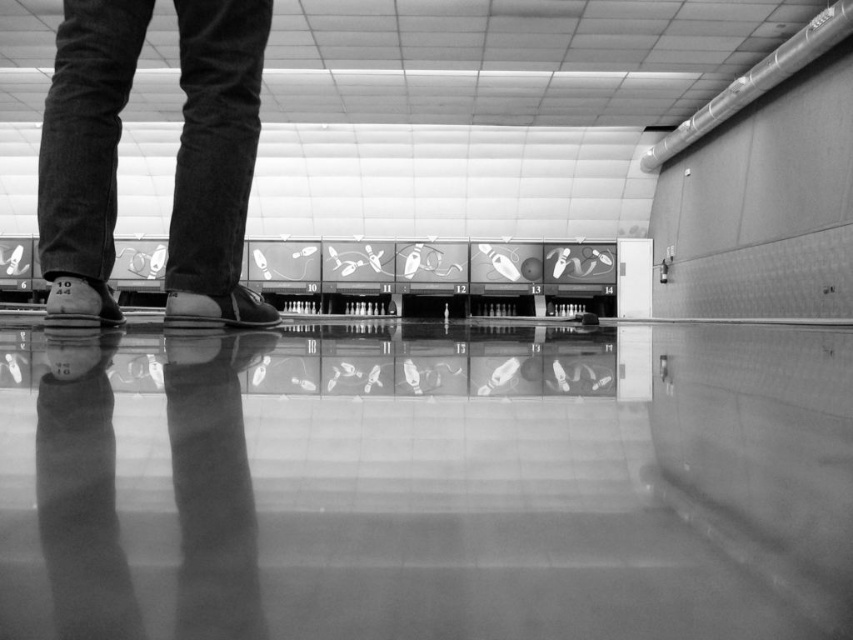
You are a delivery robot with a 10 inch wide package. You need to move from the leather at left to the dark gray suede shoes at center. Can you fit through the space between them?

The distance between the dark gray suede shoes at center and the leather at left is 9.75 inches. Since your package is 10 inches wide, it is slightly too wide to fit through the space between them.

You are a delivery robot that is 0.5 meters tall. You need to deliver a package to the bowling alley lane behind the dark gray suede shoes at center. Can you pass under the shoes without hitting your head?

The dark gray suede shoes at center are 1.57 meters away from the viewer. Since the robot is only 0.5 meters tall, it can safely pass under the dark gray suede shoes at center as the distance is sufficient.